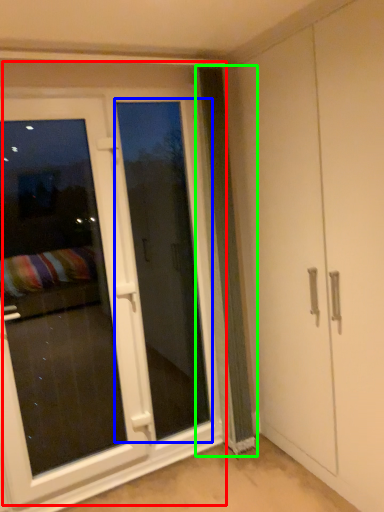
Question: Based on their relative distances, which object is nearer to door (highlighted by a red box)? Choose from screen door (highlighted by a blue box) and curtain (highlighted by a green box).

Choices:
 (A) screen door
 (B) curtain

Answer: (A)